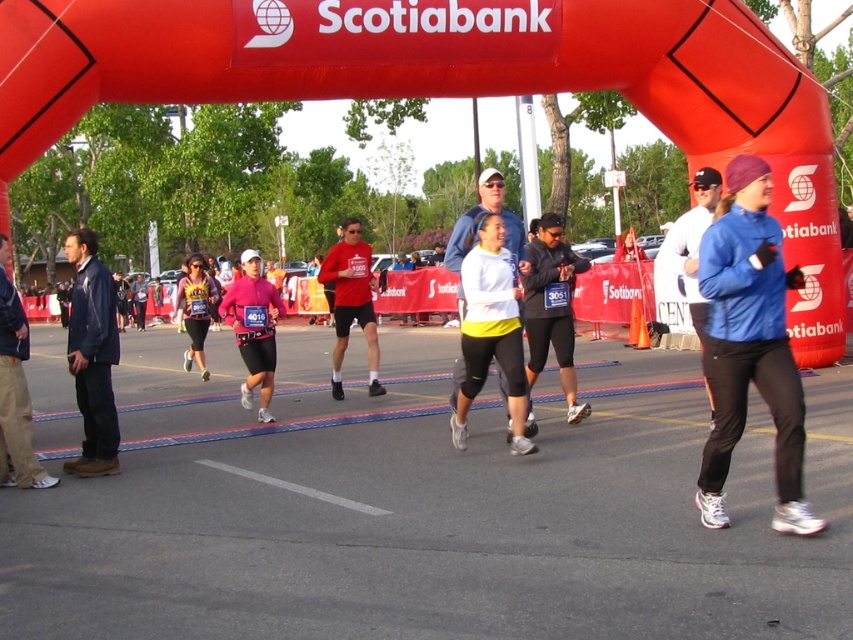
Question: Is blue matte jacket at center to the right of matte pink leggings at center from the viewer's perspective?

Choices:
 (A) no
 (B) yes

Answer: (B)

Question: Can you confirm if blue matte jacket at center is thinner than matte pink leggings at center?

Choices:
 (A) no
 (B) yes

Answer: (B)

Question: Which is farther from the matte pink leggings at center?

Choices:
 (A) blue matte jacket at center
 (B) white matte running top at center

Answer: (A)

Question: Which of the following is the farthest from the observer?

Choices:
 (A) blue matte jacket at center
 (B) white matte running top at center

Answer: (B)

Question: Where is blue matte jacket at center located in relation to white matte running top at center in the image?

Choices:
 (A) left
 (B) right

Answer: (B)

Question: Based on their relative distances, which object is farther from the matte pink leggings at center?

Choices:
 (A) white matte running top at center
 (B) blue matte jacket at center

Answer: (B)